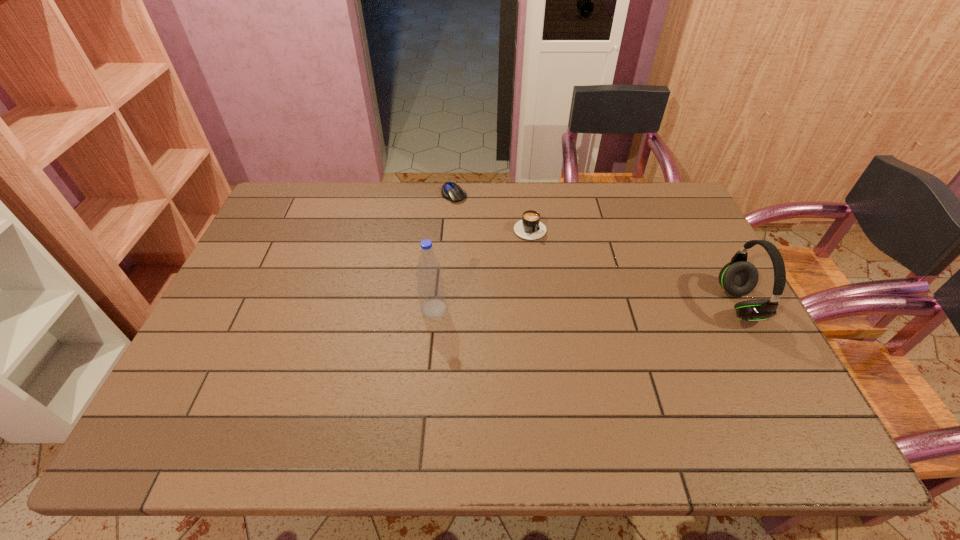
Locate an element on the screen. water bottle is located at coordinates (431, 291).

Locate an element on the screen. The width and height of the screenshot is (960, 540). the rightmost object is located at coordinates (738, 278).

Identify the location of headset. The image size is (960, 540). pos(738,278).

Find the location of a particular element. The image size is (960, 540). the second farthest object is located at coordinates (530, 227).

This screenshot has width=960, height=540. What are the coordinates of `the third object from left to right` in the screenshot? It's located at pos(530,227).

At what (x,y) coordinates should I click in order to perform the action: click on the shortest object. Please return your answer as a coordinate pair (x, y). Image resolution: width=960 pixels, height=540 pixels. Looking at the image, I should click on (451, 191).

Image resolution: width=960 pixels, height=540 pixels. I want to click on computer mouse, so click(451, 191).

At what (x,y) coordinates should I click in order to perform the action: click on free spot located 0.280m on the left of the tallest object. Please return your answer as a coordinate pair (x, y). This screenshot has height=540, width=960. Looking at the image, I should click on (316, 309).

Where is `vacant space located 0.140m with the handle on the side of the cappuccino`? vacant space located 0.140m with the handle on the side of the cappuccino is located at coordinates (561, 269).

Where is `vacant area located with the handle on the side of the cappuccino`? vacant area located with the handle on the side of the cappuccino is located at coordinates (586, 299).